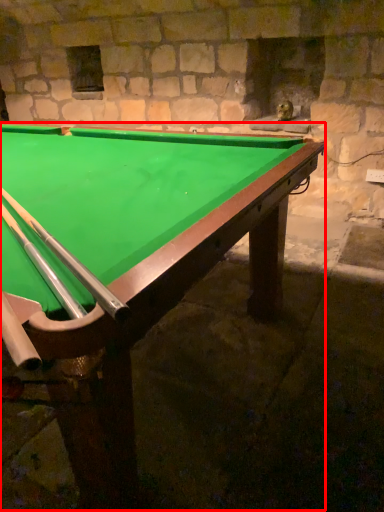
Question: Observing the image, what is the correct spatial positioning of billiard table (annotated by the red box) in reference to cue?

Choices:
 (A) left
 (B) right

Answer: (A)